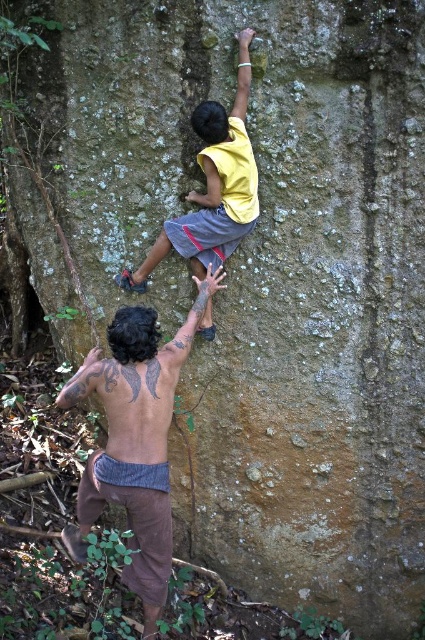
Is point (170, 416) farther from viewer compared to point (223, 253)?

No, (170, 416) is closer to viewer.

From the picture: Who is taller, brown textured shorts at lower left or yellow matte shirt at upper center?

brown textured shorts at lower left is taller.

Does point (147, 337) lie behind point (159, 256)?

No, (147, 337) is closer to viewer.

At what (x,y) coordinates should I click in order to perform the action: click on brown textured shorts at lower left. Please return your answer as a coordinate pair (x, y). The height and width of the screenshot is (640, 425). Looking at the image, I should click on (136, 436).